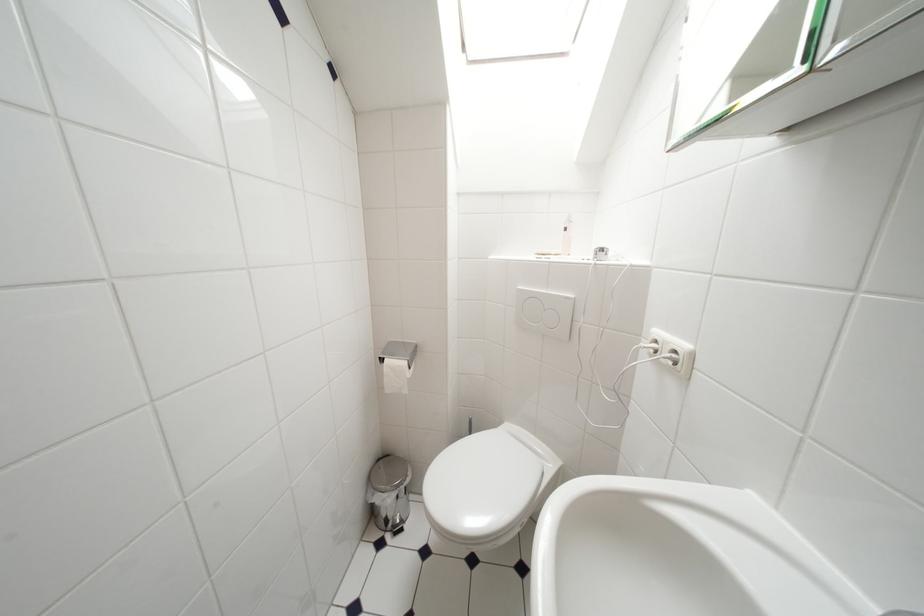
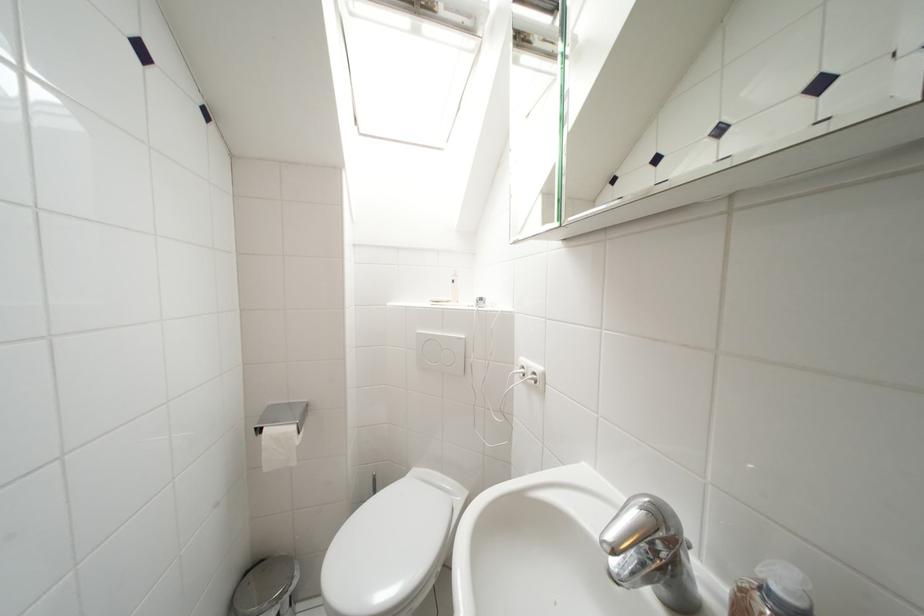
In the second image, find the point that corresponds to point (682, 355) in the first image.

(541, 377)